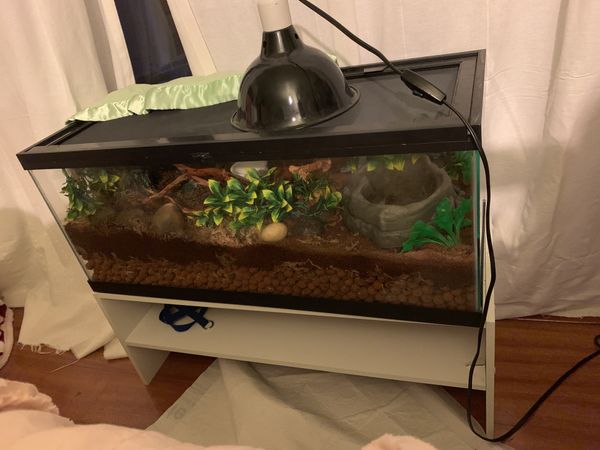
The height and width of the screenshot is (450, 600). In order to click on comforter in this screenshot , I will do `click(68, 430)`.